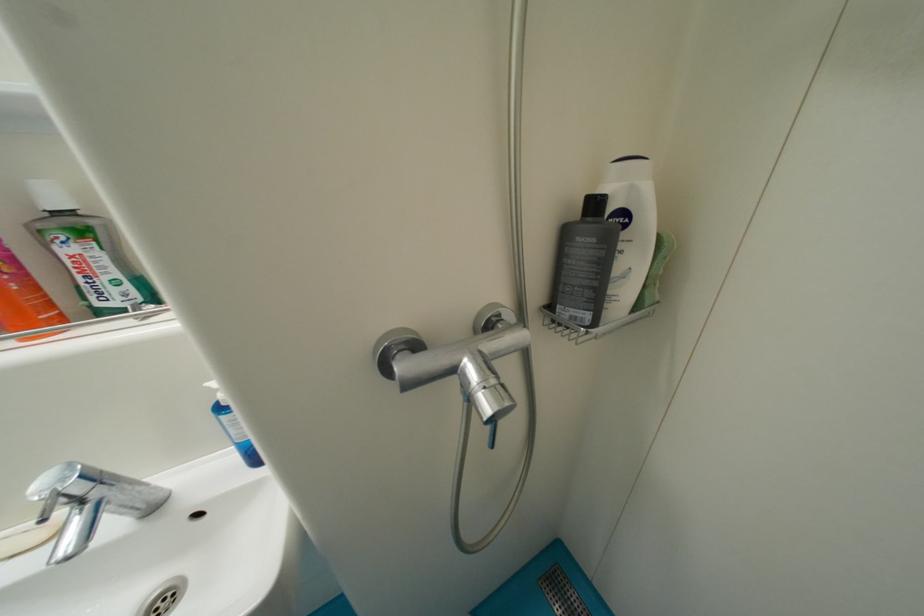
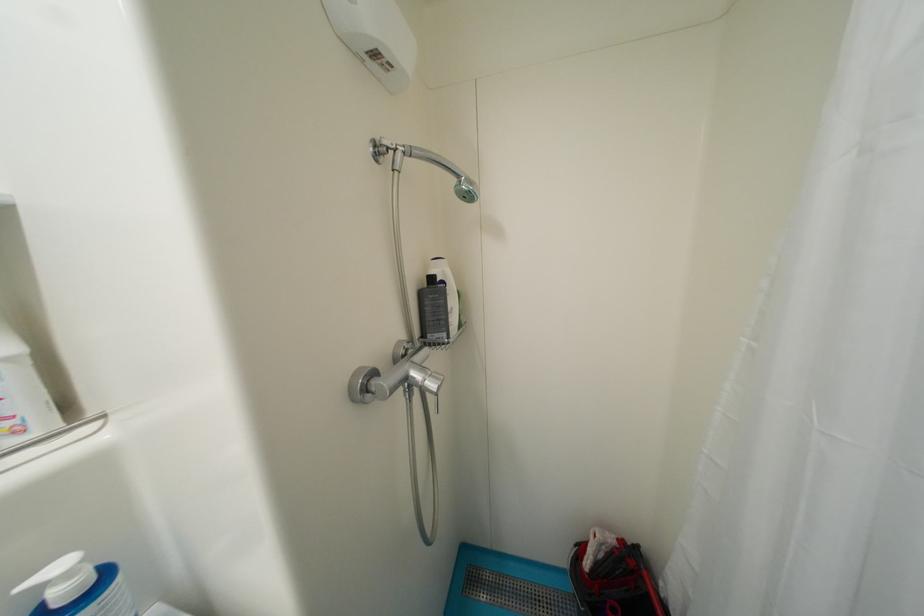
Find the pixel in the second image that matches (406,354) in the first image.

(374, 383)